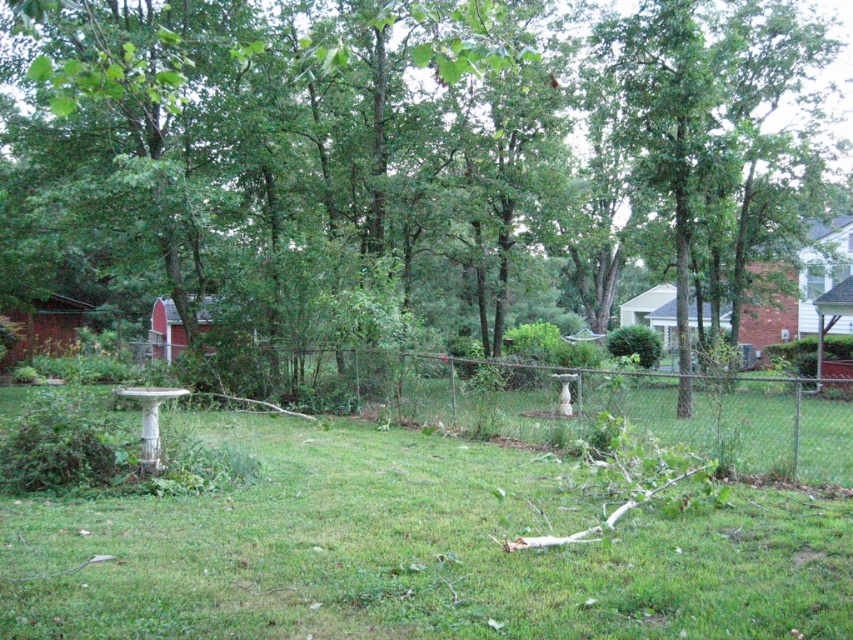
Does green leafy tree at center have a larger size compared to green grassy at center?

Yes, green leafy tree at center is bigger than green grassy at center.

Identify the location of green leafy tree at center. (399, 152).

What do you see at coordinates (399, 152) in the screenshot? I see `green leafy tree at center` at bounding box center [399, 152].

The image size is (853, 640). Find the location of `green leafy tree at center`. green leafy tree at center is located at coordinates (399, 152).